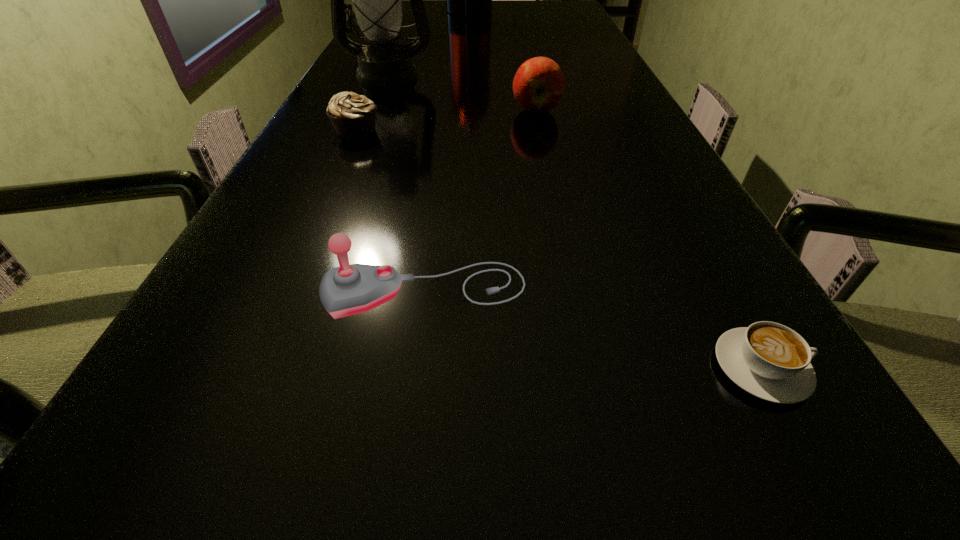
Locate an element on the screen. The width and height of the screenshot is (960, 540). fire extinguisher is located at coordinates (463, 0).

Where is `the farthest object`? This screenshot has height=540, width=960. the farthest object is located at coordinates (463, 0).

The height and width of the screenshot is (540, 960). Identify the location of oil lamp. (377, 3).

Find the location of a particular element. The height and width of the screenshot is (540, 960). the fifth shortest object is located at coordinates (377, 3).

Where is `apple`? Image resolution: width=960 pixels, height=540 pixels. apple is located at coordinates (538, 85).

Identify the location of the fifth farthest object. This screenshot has height=540, width=960. (349, 289).

Identify the location of the second shortest object. This screenshot has width=960, height=540. (353, 116).

I want to click on the shortest object, so click(771, 361).

You are a GUI agent. You are given a task and a screenshot of the screen. Output one action in this format:
    pyautogui.click(x=<x>, y=<y>)
    Task: Click on the nearest object
    The height and width of the screenshot is (540, 960).
    Given the screenshot: What is the action you would take?
    pyautogui.click(x=771, y=361)

Locate an element on the screen. The width and height of the screenshot is (960, 540). vacant space located on the front-facing side of the fire extinguisher is located at coordinates (509, 14).